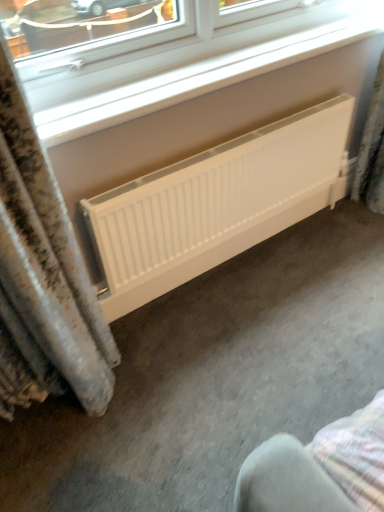
Question: Would you say white matte radiator at center is part of white plastic window at upper center's contents?

Choices:
 (A) yes
 (B) no

Answer: (B)

Question: From a real-world perspective, is white plastic window at upper center on top of white matte radiator at center?

Choices:
 (A) no
 (B) yes

Answer: (B)

Question: Considering the relative sizes of white plastic window at upper center and white matte radiator at center in the image provided, is white plastic window at upper center bigger than white matte radiator at center?

Choices:
 (A) no
 (B) yes

Answer: (A)

Question: Is white plastic window at upper center not within white matte radiator at center?

Choices:
 (A) yes
 (B) no

Answer: (A)

Question: Considering the relative sizes of white plastic window at upper center and white matte radiator at center in the image provided, is white plastic window at upper center wider than white matte radiator at center?

Choices:
 (A) no
 (B) yes

Answer: (B)

Question: Can you confirm if white plastic window at upper center is shorter than white matte radiator at center?

Choices:
 (A) no
 (B) yes

Answer: (B)

Question: From a real-world perspective, is white matte radiator at center physically above white plastic window at upper center?

Choices:
 (A) yes
 (B) no

Answer: (B)

Question: Considering the relative sizes of white matte radiator at center and white plastic window at upper center in the image provided, is white matte radiator at center taller than white plastic window at upper center?

Choices:
 (A) no
 (B) yes

Answer: (B)

Question: Is white plastic window at upper center at the back of white matte radiator at center?

Choices:
 (A) yes
 (B) no

Answer: (B)

Question: Is white matte radiator at center positioned before white plastic window at upper center?

Choices:
 (A) no
 (B) yes

Answer: (A)

Question: Can you confirm if white matte radiator at center is positioned to the right of white plastic window at upper center?

Choices:
 (A) yes
 (B) no

Answer: (A)

Question: Is white matte radiator at center bigger than white plastic window at upper center?

Choices:
 (A) no
 (B) yes

Answer: (B)

Question: Considering the positions of point (175, 243) and point (326, 13), is point (175, 243) closer or farther from the camera than point (326, 13)?

Choices:
 (A) farther
 (B) closer

Answer: (B)